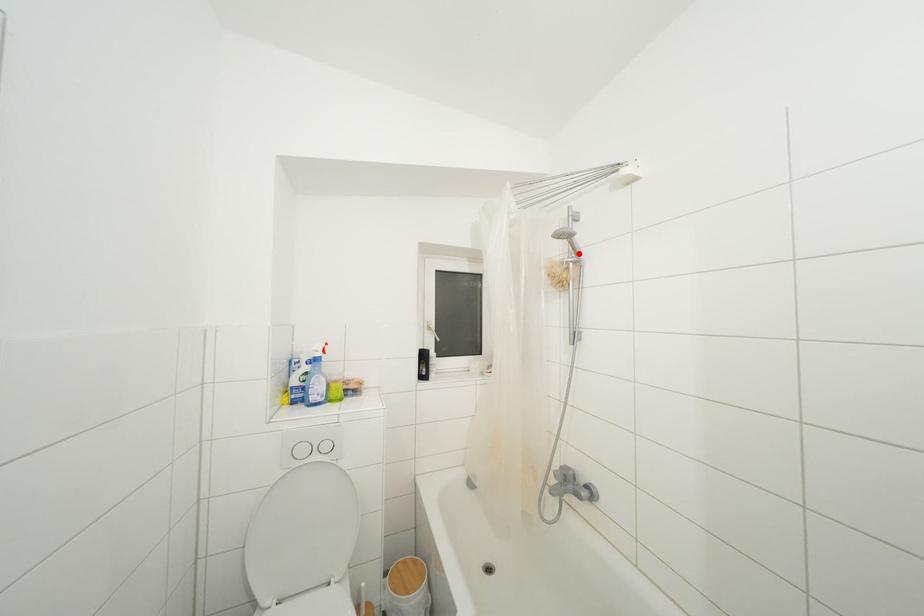
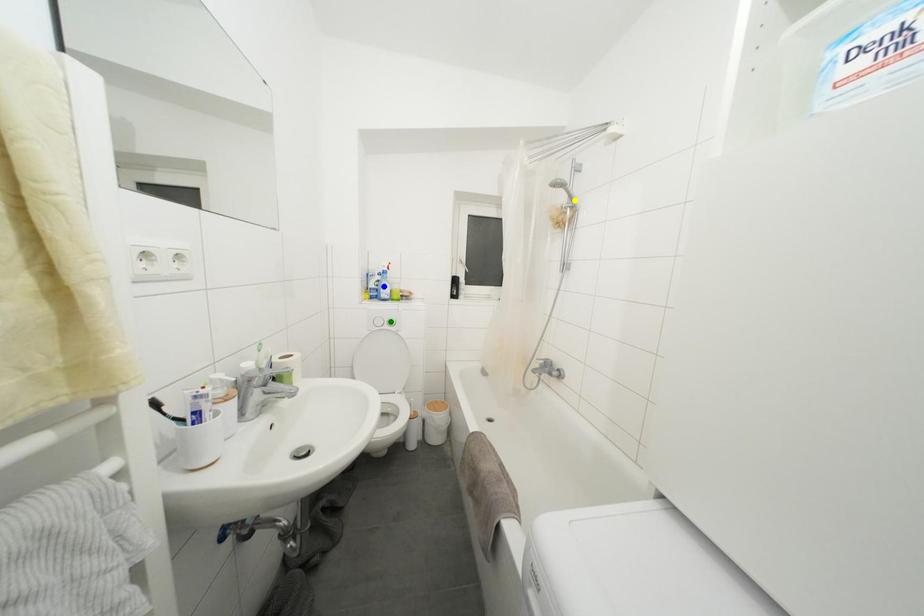
Question: I am providing you with two images of the same scene from different viewpoints. A red point is marked on the first image. You are given multiple points on the second image. Which spot in image 2 lines up with the point in image 1?

Choices:
 (A) blue point
 (B) yellow point
 (C) green point

Answer: (B)